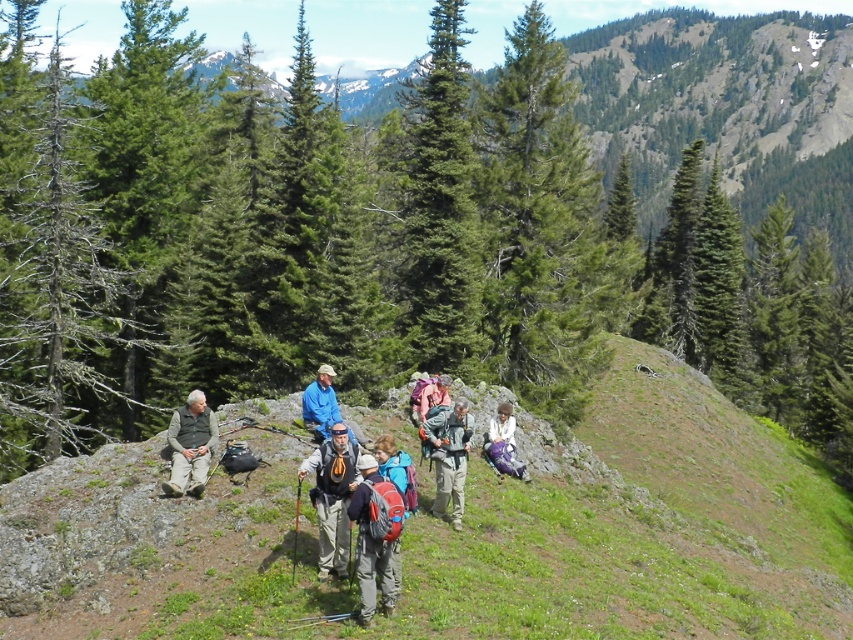
Question: Is matte blue backpack at center thinner than green fabric jacket at left?

Choices:
 (A) no
 (B) yes

Answer: (B)

Question: From the image, what is the correct spatial relationship of green matte evergreen tree at center in relation to blue fabric jacket at center?

Choices:
 (A) right
 (B) left

Answer: (A)

Question: Based on their relative distances, which object is nearer to the matte gray backpack at center?

Choices:
 (A) green grassy hillside at center
 (B) matte green backpack at center

Answer: (B)

Question: Which object appears farthest from the camera in this image?

Choices:
 (A) purple fabric bag at center
 (B) green grassy hillside at center
 (C) matte gray backpack at center
 (D) matte blue backpack at center

Answer: (A)

Question: Among these points, which one is nearest to the camera?

Choices:
 (A) (325, 432)
 (B) (444, 438)
 (C) (602, 550)
 (D) (514, 419)

Answer: (B)

Question: Can you confirm if green matte evergreen tree at center is positioned to the right of matte green backpack at center?

Choices:
 (A) yes
 (B) no

Answer: (B)